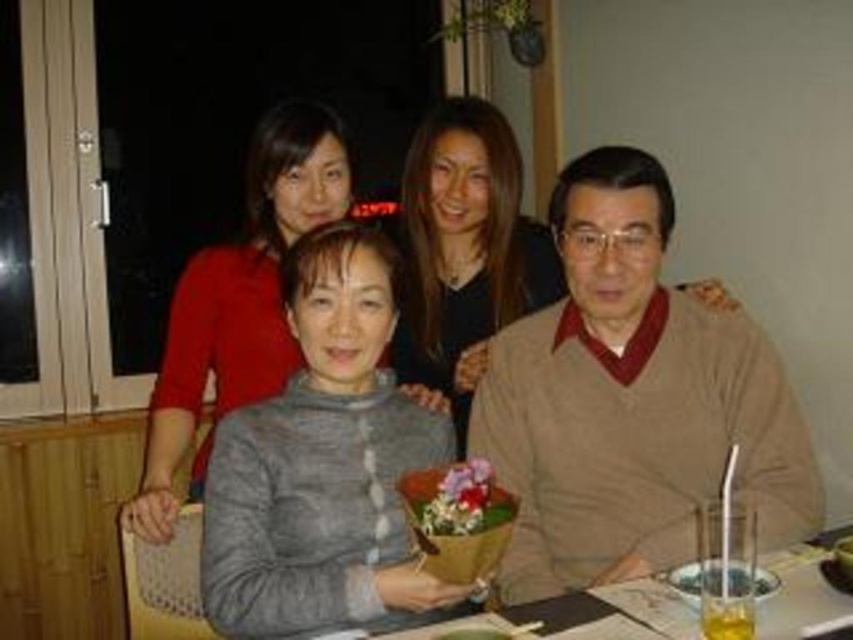
Image resolution: width=853 pixels, height=640 pixels. Describe the element at coordinates (241, 298) in the screenshot. I see `gray knitted sweater at center` at that location.

Between point (194, 465) and point (776, 580), which one is positioned behind?

The point (194, 465) is more distant.

What do you see at coordinates (241, 298) in the screenshot?
I see `gray knitted sweater at center` at bounding box center [241, 298].

Image resolution: width=853 pixels, height=640 pixels. In order to click on gray knitted sweater at center in this screenshot , I will do `click(241, 298)`.

Which is above, gray knitted sweater at center or smooth wooden table at center?

gray knitted sweater at center is above.

Is point (277, 234) positioned after point (836, 536)?

Yes, point (277, 234) is farther from viewer.

The width and height of the screenshot is (853, 640). What are the coordinates of `gray knitted sweater at center` in the screenshot? It's located at (241, 298).

Consider the image. Which is below, gray wool sweater at center or translucent glass bowl at lower right?

Positioned lower is translucent glass bowl at lower right.

Between gray wool sweater at center and translucent glass bowl at lower right, which one has more height?

gray wool sweater at center is taller.

What do you see at coordinates (466, 253) in the screenshot? Image resolution: width=853 pixels, height=640 pixels. I see `gray wool sweater at center` at bounding box center [466, 253].

Locate an element on the screen. The width and height of the screenshot is (853, 640). gray wool sweater at center is located at coordinates (466, 253).